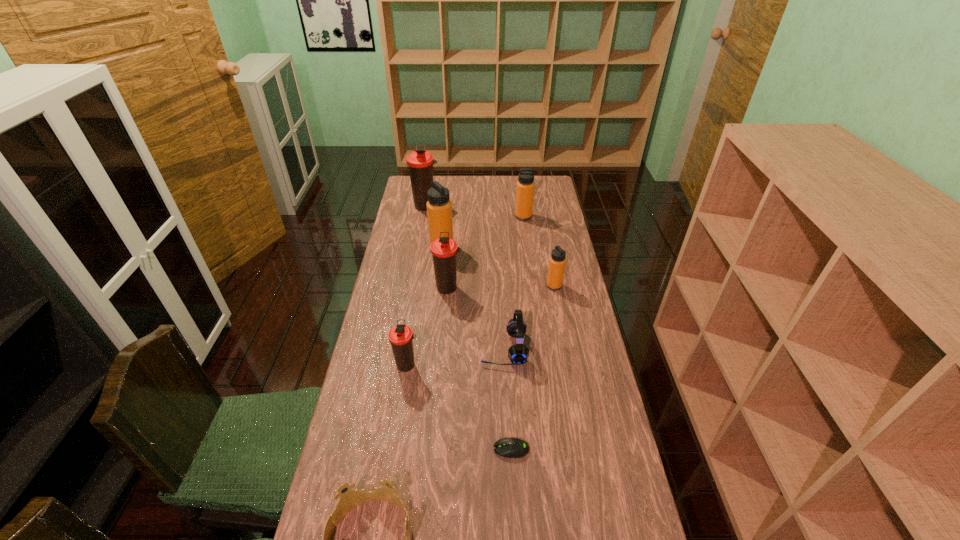
Locate an element on the screen. This screenshot has height=540, width=960. object that stands as the fourth closest to the second smallest brown thermos bottle is located at coordinates (557, 261).

Identify which thermos bottle is the second closest to the second nearest object. Please provide its 2D coordinates. Your answer should be formatted as a tuple, i.e. [(x, y)], where the tuple contains the x and y coordinates of a point satisfying the conditions above.

[(444, 249)]

Choose which thermos bottle is the second nearest neighbor to the second biggest brown thermos bottle. Please provide its 2D coordinates. Your answer should be formatted as a tuple, i.e. [(x, y)], where the tuple contains the x and y coordinates of a point satisfying the conditions above.

[(400, 336)]

Identify the location of brown thermos bottle that is the second closest to the shortest object. (444, 249).

Where is `brown thermos bottle object that ranks as the closest to the smallest brown thermos bottle`? This screenshot has width=960, height=540. brown thermos bottle object that ranks as the closest to the smallest brown thermos bottle is located at coordinates (444, 249).

Identify which orange thermos bottle is located as the third nearest to the rightmost brown thermos bottle. Please provide its 2D coordinates. Your answer should be formatted as a tuple, i.e. [(x, y)], where the tuple contains the x and y coordinates of a point satisfying the conditions above.

[(525, 186)]

Find the location of a particular element. Image resolution: width=960 pixels, height=540 pixels. orange thermos bottle that stands as the third closest to the eighth tallest object is located at coordinates (525, 186).

At what (x,y) coordinates should I click in order to perform the action: click on free space in the image that satisfies the following two spatial constraints: 1. on the ear cushions of the headset; 2. on the front side of the nearest brown thermos bottle. Please return your answer as a coordinate pair (x, y). Image resolution: width=960 pixels, height=540 pixels. Looking at the image, I should click on (504, 365).

The width and height of the screenshot is (960, 540). Find the location of `blank area in the image that satisfies the following two spatial constraints: 1. on the front side of the smallest orange thermos bottle; 2. on the wheel side of the second nearest object`. blank area in the image that satisfies the following two spatial constraints: 1. on the front side of the smallest orange thermos bottle; 2. on the wheel side of the second nearest object is located at coordinates (585, 449).